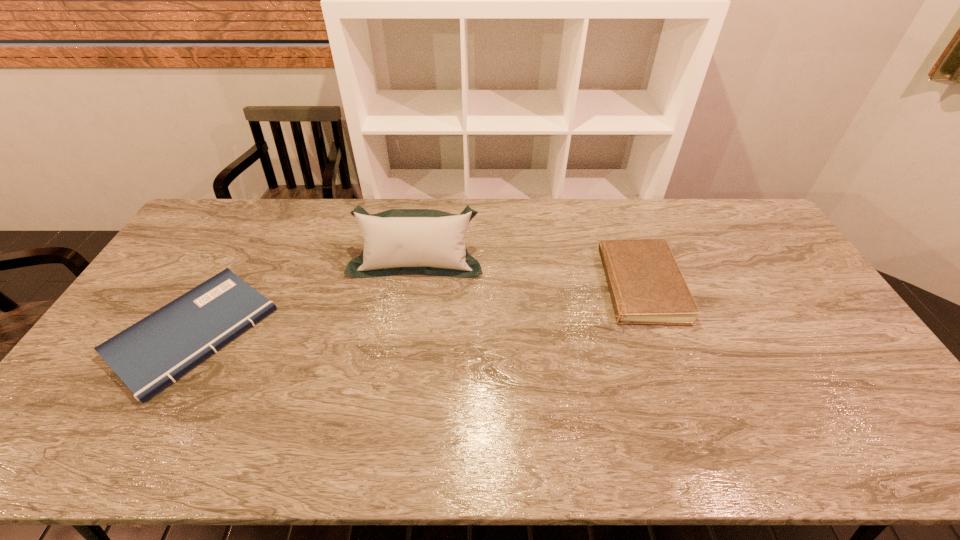
Locate an element on the screen. vacant space that is in between the shortest object and the taller paperback book is located at coordinates (413, 309).

You are a GUI agent. You are given a task and a screenshot of the screen. Output one action in this format:
    pyautogui.click(x=<x>, y=<y>)
    Task: Click on the free spot between the left paperback book and the rightmost object
    
    Given the screenshot: What is the action you would take?
    pyautogui.click(x=413, y=309)

Where is `vacant area that lies between the second object from left to right and the left paperback book`? vacant area that lies between the second object from left to right and the left paperback book is located at coordinates (305, 296).

I want to click on free space between the tallest object and the rightmost object, so (x=524, y=273).

At what (x,y) coordinates should I click in order to perform the action: click on free space between the leftmost object and the taller paperback book. Please return your answer as a coordinate pair (x, y). Image resolution: width=960 pixels, height=540 pixels. Looking at the image, I should click on pyautogui.click(x=413, y=309).

Locate an element on the screen. This screenshot has width=960, height=540. vacant area that lies between the left paperback book and the cushion is located at coordinates (305, 296).

This screenshot has height=540, width=960. I want to click on object identified as the closest to the taller paperback book, so click(430, 242).

Locate an element on the screen. Image resolution: width=960 pixels, height=540 pixels. object that ranks as the second closest to the right paperback book is located at coordinates (148, 356).